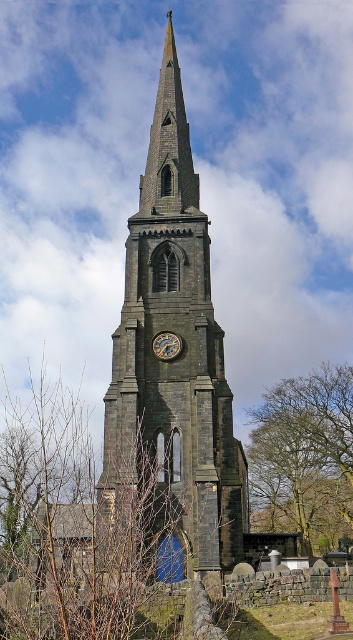
Which of these two, dark gray stone clock tower at center or bare branches at center, stands taller?

With more height is dark gray stone clock tower at center.

Is dark gray stone clock tower at center positioned in front of bare branches at center?

That is True.

Describe the element at coordinates (181, 349) in the screenshot. I see `dark gray stone clock tower at center` at that location.

I want to click on dark gray stone clock tower at center, so click(x=181, y=349).

Looking at this image, does bare branches at center appear on the left side of gold metallic clock at center?

Incorrect, bare branches at center is not on the left side of gold metallic clock at center.

Consider the image. Does bare branches at center come behind gold metallic clock at center?

Yes, bare branches at center is behind gold metallic clock at center.

Is point (326, 545) positioned before point (171, 353)?

No, (326, 545) is further to viewer.

Locate an element on the screen. The image size is (353, 640). bare branches at center is located at coordinates (306, 452).

Between dark gray stone clock tower at center and gold metallic clock at center, which one appears on the left side from the viewer's perspective?

From the viewer's perspective, dark gray stone clock tower at center appears more on the left side.

Which of these two, dark gray stone clock tower at center or gold metallic clock at center, stands shorter?

Standing shorter between the two is gold metallic clock at center.

Between point (133, 330) and point (178, 337), which one is positioned behind?

Point (178, 337)

Find the location of a particular element. dark gray stone clock tower at center is located at coordinates (181, 349).